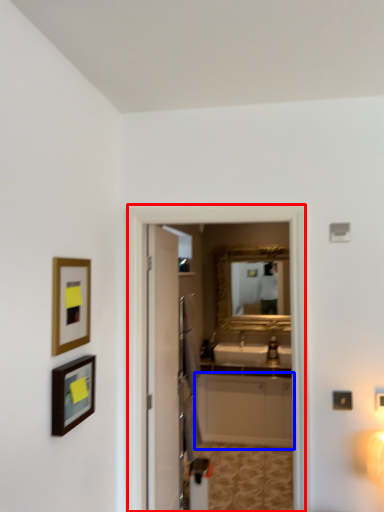
Question: Among these objects, which one is farthest to the camera, screen door (highlighted by a red box) or cabinetry (highlighted by a blue box)?

Choices:
 (A) screen door
 (B) cabinetry

Answer: (B)